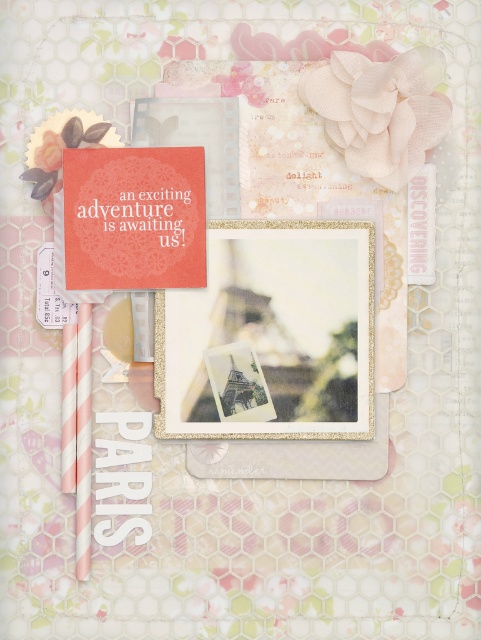
You are organizing a scrapbook page and need to place the matte paper postcard at center and the peachy fabric flower at upper right. Based on their sizes, which object would require more horizontal space on the page?

The matte paper postcard at center might require more horizontal space on the page since it is wider than the peachy fabric flower at upper right.

What is located at the point with coordinates (269, 336) on the scrapbook page?

The point with coordinates (269, 336) on the scrapbook page indicates the location of the matte paper postcard at center.

You are organizing a scrapbook page and have a matte paper postcard at center and a peachy fabric flower at upper right. Which object is taller?

The matte paper postcard at center is taller than the peachy fabric flower at upper right.